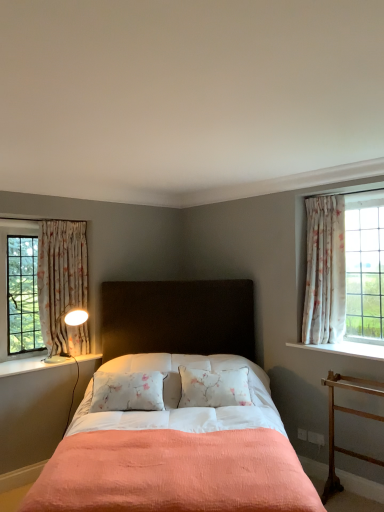
The width and height of the screenshot is (384, 512). Describe the element at coordinates (350, 413) in the screenshot. I see `wooden at right` at that location.

In order to click on matte black headboard at center in this screenshot , I will do `click(176, 414)`.

Consider the image. Measure the distance between white painted wood at left, which is the first window sill in left-to-right order, and camera.

white painted wood at left, which is the first window sill in left-to-right order, and camera are 3.35 meters apart from each other.

Where is `wooden at right`? The width and height of the screenshot is (384, 512). wooden at right is located at coordinates (350, 413).

From the image's perspective, is white painted wood at right, which is the second window sill in bottom-to-top order, above or below matte black headboard at center?

white painted wood at right, which is the second window sill in bottom-to-top order, is situated higher than matte black headboard at center in the image.

Is white painted wood at right, which is the second window sill in bottom-to-top order, turned away from matte black headboard at center?

No.

The image size is (384, 512). In order to click on the 2nd window sill positioned above the matte black headboard at center (from the image's perspective) in this screenshot , I will do `click(346, 349)`.

Are wooden at right and white painted wood at left, which is the first window sill in left-to-right order, making contact?

No, wooden at right is not in contact with white painted wood at left, which is the first window sill in left-to-right order.

Visually, is wooden at right positioned to the left or to the right of white painted wood at left, which is the second window sill in right-to-left order?

Based on their positions, wooden at right is located to the right of white painted wood at left, which is the second window sill in right-to-left order.

Could you tell me if wooden at right is facing white painted wood at left, which is the first window sill in left-to-right order?

No, wooden at right is not turned towards white painted wood at left, which is the first window sill in left-to-right order.

Which object is positioned more to the right, white painted wood at right, which is the 1th window sill from top to bottom, or floral fabric curtain at left, positioned as the 2th curtain in right-to-left order?

white painted wood at right, which is the 1th window sill from top to bottom, is more to the right.

In the scene shown: Looking at their sizes, would you say white painted wood at right, which is the second window sill in bottom-to-top order, is wider or thinner than floral fabric curtain at left, marked as the first curtain in a left-to-right arrangement?

Clearly, white painted wood at right, which is the second window sill in bottom-to-top order, has more width compared to floral fabric curtain at left, marked as the first curtain in a left-to-right arrangement.

Is white painted wood at right, which is counted as the first window sill, starting from the right, touching floral fabric curtain at left, positioned as the 2th curtain in right-to-left order?

white painted wood at right, which is counted as the first window sill, starting from the right, and floral fabric curtain at left, positioned as the 2th curtain in right-to-left order, are clearly separated.

From the image's perspective, is matte black headboard at center located above or below matte white table lamp at left?

matte black headboard at center is below matte white table lamp at left.

Is matte black headboard at center inside or outside of matte white table lamp at left?

matte black headboard at center lies outside matte white table lamp at left.

Which is more to the left, matte black headboard at center or matte white table lamp at left?

matte white table lamp at left.

Is matte white table lamp at left at the back of matte black headboard at center?

matte black headboard at center is not turned away from matte white table lamp at left.

Is wooden at right situated inside floral fabric curtain at left, positioned as the 2th curtain in right-to-left order, or outside?

wooden at right exists outside the volume of floral fabric curtain at left, positioned as the 2th curtain in right-to-left order.

Is wooden at right not near floral fabric curtain at left, marked as the first curtain in a left-to-right arrangement?

Absolutely, wooden at right is distant from floral fabric curtain at left, marked as the first curtain in a left-to-right arrangement.

Between wooden at right and floral fabric curtain at left, positioned as the 2th curtain in right-to-left order, which one has larger width?

Wider between the two is wooden at right.

Is white painted wood at left, which is the first window sill in left-to-right order, touching floral fabric curtain at right, the second curtain viewed from the left?

No, white painted wood at left, which is the first window sill in left-to-right order, is not making contact with floral fabric curtain at right, the second curtain viewed from the left.

How many degrees apart are the facing directions of white painted wood at left, which is counted as the 2th window sill, starting from the top, and floral fabric curtain at right, marked as the first curtain in a right-to-left arrangement?

The angular difference between white painted wood at left, which is counted as the 2th window sill, starting from the top, and floral fabric curtain at right, marked as the first curtain in a right-to-left arrangement, is 90 degrees.

From a real-world perspective, is white painted wood at left, which is the first window sill in left-to-right order, on top of floral fabric curtain at right, the second curtain viewed from the left?

No, from a real-world perspective, white painted wood at left, which is the first window sill in left-to-right order, is not on top of floral fabric curtain at right, the second curtain viewed from the left.

Which is in front, point (2, 377) or point (325, 340)?

The point (2, 377) is in front.

Considering the relative sizes of matte black headboard at center and white painted wood at left, which is counted as the 2th window sill, starting from the top, in the image provided, is matte black headboard at center thinner than white painted wood at left, which is counted as the 2th window sill, starting from the top,?

In fact, matte black headboard at center might be wider than white painted wood at left, which is counted as the 2th window sill, starting from the top.

Is matte black headboard at center aimed at white painted wood at left, which is the first window sill in left-to-right order?

No, matte black headboard at center does not turn towards white painted wood at left, which is the first window sill in left-to-right order.

Considering the relative positions of matte black headboard at center and white painted wood at left, which is the first window sill in left-to-right order, in the image provided, is matte black headboard at center behind white painted wood at left, which is the first window sill in left-to-right order,?

No, the depth of matte black headboard at center is less than that of white painted wood at left, which is the first window sill in left-to-right order.

Is matte black headboard at center bigger than white painted wood at left, which is the second window sill in right-to-left order?

Yes, matte black headboard at center is bigger than white painted wood at left, which is the second window sill in right-to-left order.

There is a matte black headboard at center. Identify the location of the 2nd window sill above it (from the image's perspective). The width and height of the screenshot is (384, 512). (346, 349).

Identify the location of nightstand below the white painted wood at left, which is the second window sill in right-to-left order (from a real-world perspective). The width and height of the screenshot is (384, 512). (350, 413).

Considering their positions, is white painted wood at left, which is counted as the first window sill, starting from the bottom, positioned closer to matte black headboard at center than white painted wood at right, which is counted as the first window sill, starting from the right?

white painted wood at right, which is counted as the first window sill, starting from the right.

Based on their spatial positions, is wooden at right or floral fabric curtain at right, the second curtain viewed from the left, closer to matte white table lamp at left?

The object closer to matte white table lamp at left is floral fabric curtain at right, the second curtain viewed from the left.

Estimate the real-world distances between objects in this image. Which object is further from floral fabric curtain at left, positioned as the 2th curtain in right-to-left order, white painted wood at right, which is counted as the first window sill, starting from the right, or matte black headboard at center?

white painted wood at right, which is counted as the first window sill, starting from the right, is further to floral fabric curtain at left, positioned as the 2th curtain in right-to-left order.

Looking at the image, which one is located closer to wooden at right, floral fabric curtain at left, positioned as the 2th curtain in right-to-left order, or matte white table lamp at left?

matte white table lamp at left.

When comparing their distances from matte black headboard at center, does white painted wood at right, which is the 1th window sill from top to bottom, or wooden at right seem closer?

wooden at right is positioned closer to the anchor matte black headboard at center.

From the image, which object appears to be farther from floral fabric curtain at right, marked as the first curtain in a right-to-left arrangement, wooden at right or floral fabric curtain at left, positioned as the 2th curtain in right-to-left order?

floral fabric curtain at left, positioned as the 2th curtain in right-to-left order, is positioned further to the anchor floral fabric curtain at right, marked as the first curtain in a right-to-left arrangement.

Estimate the real-world distances between objects in this image. Which object is closer to white painted wood at left, which is counted as the first window sill, starting from the bottom, floral fabric curtain at left, positioned as the 2th curtain in right-to-left order, or matte white table lamp at left?

Among the two, matte white table lamp at left is located nearer to white painted wood at left, which is counted as the first window sill, starting from the bottom.

Which object lies further to the anchor point white painted wood at left, which is counted as the 2th window sill, starting from the top, floral fabric curtain at right, the second curtain viewed from the left, or white painted wood at right, which is counted as the first window sill, starting from the right?

floral fabric curtain at right, the second curtain viewed from the left, is further to white painted wood at left, which is counted as the 2th window sill, starting from the top.

Where is `curtain between floral fabric curtain at left, marked as the first curtain in a left-to-right arrangement, and wooden at right from left to right`? The width and height of the screenshot is (384, 512). curtain between floral fabric curtain at left, marked as the first curtain in a left-to-right arrangement, and wooden at right from left to right is located at coordinates (325, 271).

The width and height of the screenshot is (384, 512). In order to click on table lamp located between white painted wood at left, which is counted as the first window sill, starting from the bottom, and wooden at right in the left-right direction in this screenshot , I will do `click(76, 317)`.

Image resolution: width=384 pixels, height=512 pixels. Identify the location of nightstand between white painted wood at left, which is the first window sill in left-to-right order, and white painted wood at right, which is the second window sill in bottom-to-top order, in the horizontal direction. (350, 413).

This screenshot has width=384, height=512. I want to click on bed between matte white table lamp at left and floral fabric curtain at right, marked as the first curtain in a right-to-left arrangement, so click(x=176, y=414).